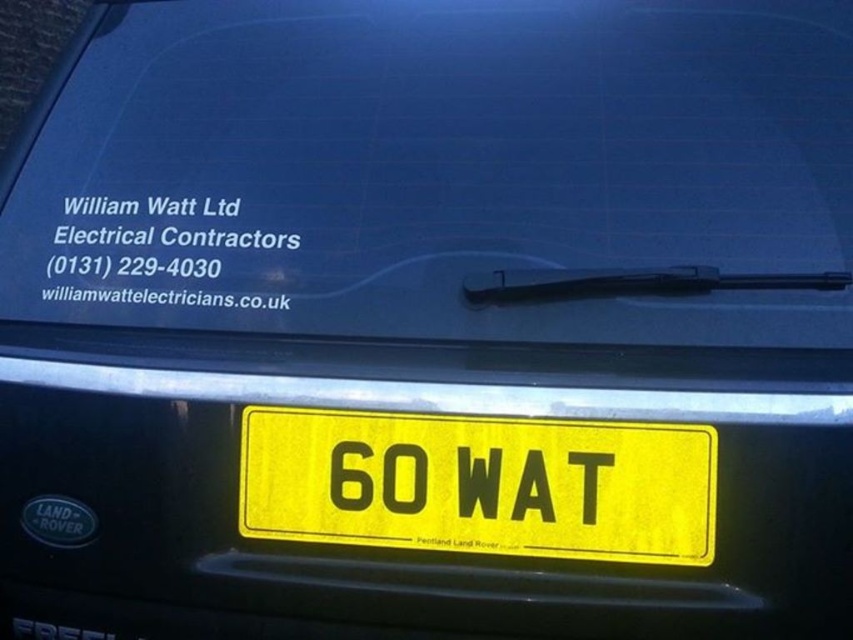
You are standing in front of a Land Rover and want to touch the point at coordinates point (639, 252). Can you reach it without moving closer? The car is at its current position. Your outstretched hand can reach up to 1.8 meters. Please answer based on the given information.

The point (639, 252) is 1.76 meters from viewer, so yes, you can reach it without moving closer since your hand can reach up to 1.8 meters, which is slightly longer than the distance to the point.

You are a delivery driver who needs to attach a GPS tracker to the rear of the vehicle. The tracker requires a minimum height of 15 cm to fit properly. Given the yellow matte license plate at center and the transparent rubber wiper at upper center, which object can accommodate the GPS tracker based on their height?

The yellow matte license plate at center is much taller than the transparent rubber wiper at upper center, so the GPS tracker can be attached to the yellow matte license plate at center as it meets the minimum height requirement of 15 cm.